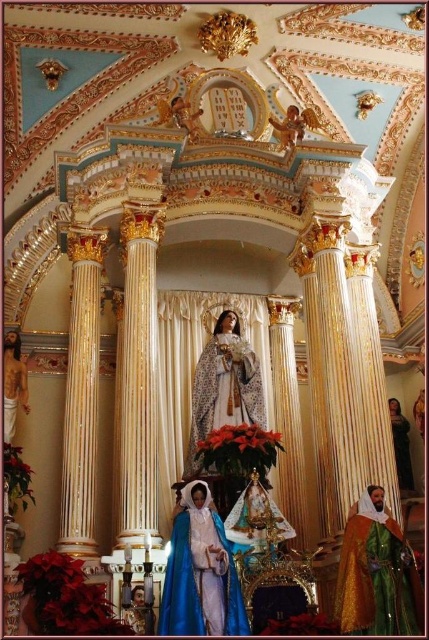
Does matte white statue at center have a lesser height compared to dark blue velvet robe at right?

Incorrect, matte white statue at center's height does not fall short of dark blue velvet robe at right's.

Locate an element on the screen. matte white statue at center is located at coordinates (223, 387).

Who is more forward, (238,371) or (404,444)?

Point (238,371) is more forward.

The height and width of the screenshot is (640, 429). Identify the location of matte white statue at center. (223, 387).

Which of these two, blue velvet statue at center or matte white statue at center, stands taller?

matte white statue at center

Who is more forward, [247,632] or [256,404]?

Positioned in front is point [247,632].

Identify the location of blue velvet statue at center. (x=201, y=573).

Is point (386, 618) in front of point (193, 621)?

No, it is behind (193, 621).

Which is behind, point (401, 592) or point (178, 550)?

The point (178, 550) is more distant.

Where is `gold textured robe at lower right`? gold textured robe at lower right is located at coordinates (377, 573).

The width and height of the screenshot is (429, 640). I want to click on gold textured robe at lower right, so click(x=377, y=573).